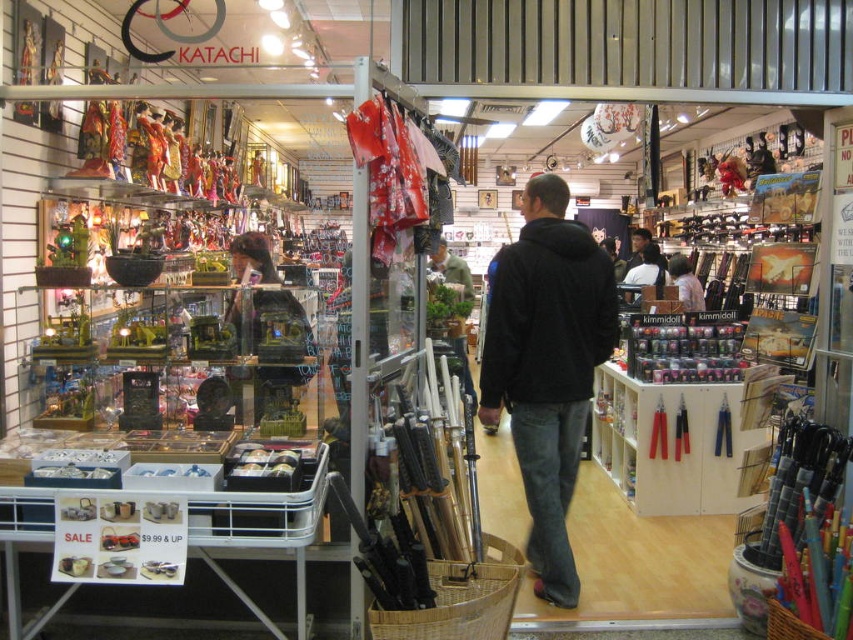
You are a customer in the store and want to pick up both the dark brown leather jacket at center and the white matte umbrella at center. How far apart are these two items?

The dark brown leather jacket at center and the white matte umbrella at center are 17.19 inches apart from each other.